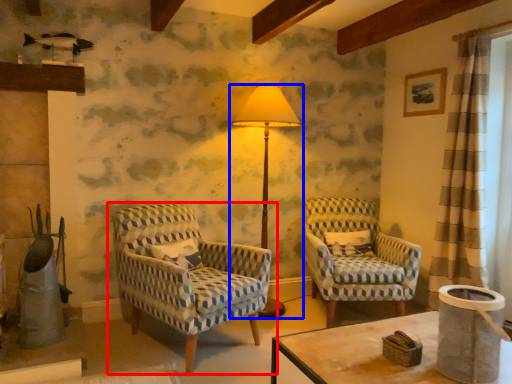
Question: Which point is further to the camera, chair (highlighted by a red box) or lamp (highlighted by a blue box)?

Choices:
 (A) chair
 (B) lamp

Answer: (B)